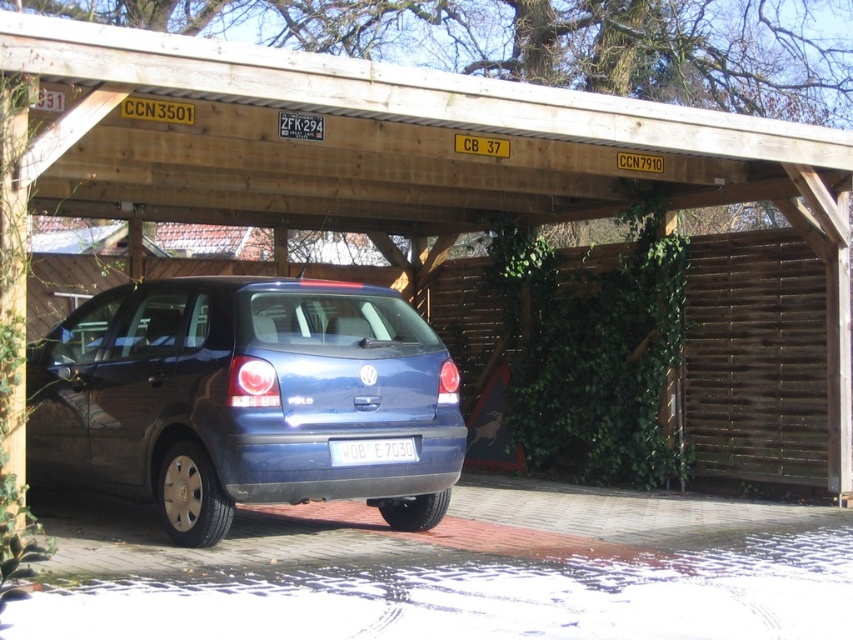
Question: Can you confirm if matte blue hatchback at center is positioned below white plastic license plate at rear?

Choices:
 (A) yes
 (B) no

Answer: (B)

Question: Where is matte blue hatchback at center located in relation to white plastic license plate at rear in the image?

Choices:
 (A) above
 (B) below

Answer: (A)

Question: Is matte blue hatchback at center closer to the viewer compared to white plastic license plate at rear?

Choices:
 (A) yes
 (B) no

Answer: (A)

Question: Which of the following is the farthest from the observer?

Choices:
 (A) (339, 417)
 (B) (350, 465)

Answer: (A)

Question: Which point is closer to the camera?

Choices:
 (A) matte blue hatchback at center
 (B) white plastic license plate at rear

Answer: (A)